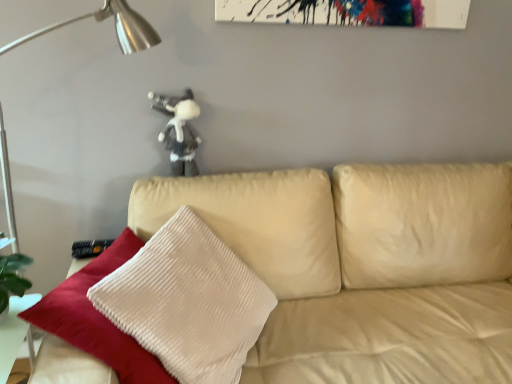
Image resolution: width=512 pixels, height=384 pixels. Identify the location of metallic silver table lamp at left. (115, 26).

Image resolution: width=512 pixels, height=384 pixels. Describe the element at coordinates (364, 267) in the screenshot. I see `beige leather couch at center` at that location.

The height and width of the screenshot is (384, 512). In order to click on beige leather couch at center in this screenshot , I will do `click(364, 267)`.

Find the location of a particular element. metallic silver table lamp at left is located at coordinates (115, 26).

From the image's perspective, does metallic silver table lamp at left appear higher than beige leather couch at center?

Yes.

Based on the photo, considering the positions of objects metallic silver table lamp at left and beige leather couch at center in the image provided, who is in front, metallic silver table lamp at left or beige leather couch at center?

Positioned in front is beige leather couch at center.

Is metallic silver table lamp at left bigger than beige leather couch at center?

Actually, metallic silver table lamp at left might be smaller than beige leather couch at center.

Is metallic silver table lamp at left to the right of beige leather couch at center from the viewer's perspective?

No, metallic silver table lamp at left is not to the right of beige leather couch at center.

From a real-world perspective, does metallic silver table lamp at left stand above white plush toy at upper center?

No, from a real-world perspective, metallic silver table lamp at left is not on top of white plush toy at upper center.

Locate an element on the screen. The width and height of the screenshot is (512, 384). table lamp below the white plush toy at upper center (from the image's perspective) is located at coordinates (115, 26).

Is metallic silver table lamp at left wider than white plush toy at upper center?

Yes, metallic silver table lamp at left is wider than white plush toy at upper center.

Looking at the image, does metallic silver table lamp at left seem bigger or smaller compared to white plush toy at upper center?

Clearly, metallic silver table lamp at left is larger in size than white plush toy at upper center.

Visually, is beige leather couch at center positioned to the left or to the right of white plush toy at upper center?

beige leather couch at center is to the right of white plush toy at upper center.

Can you confirm if beige leather couch at center is thinner than white plush toy at upper center?

No.

Is beige leather couch at center next to white plush toy at upper center and touching it?

beige leather couch at center and white plush toy at upper center are clearly separated.

Which object is further away from the camera, beige leather couch at center or metallic silver table lamp at left?

metallic silver table lamp at left is further from the camera.

Is beige leather couch at center positioned with its back to metallic silver table lamp at left?

beige leather couch at center is not turned away from metallic silver table lamp at left.

How different are the orientations of beige leather couch at center and metallic silver table lamp at left in degrees?

The angle between the facing direction of beige leather couch at center and the facing direction of metallic silver table lamp at left is 0.122 degrees.

Does beige leather couch at center have a lesser height compared to metallic silver table lamp at left?

Indeed, beige leather couch at center has a lesser height compared to metallic silver table lamp at left.

This screenshot has width=512, height=384. Find the location of `figurine to the right of metallic silver table lamp at left`. figurine to the right of metallic silver table lamp at left is located at coordinates (179, 131).

From a real-world perspective, is white plush toy at upper center above or below metallic silver table lamp at left?

Clearly, from a real-world perspective, white plush toy at upper center is above metallic silver table lamp at left.

From the image's perspective, between white plush toy at upper center and metallic silver table lamp at left, who is located below?

metallic silver table lamp at left is shown below in the image.

From a real-world perspective, is white plush toy at upper center physically located above or below beige leather couch at center?

white plush toy at upper center is above beige leather couch at center.

From the image's perspective, does white plush toy at upper center appear higher than beige leather couch at center?

Yes.

Where is `table lamp behind the beige leather couch at center`? The image size is (512, 384). table lamp behind the beige leather couch at center is located at coordinates (115, 26).

In order to click on figurine that appears on the right of metallic silver table lamp at left in this screenshot , I will do `click(179, 131)`.

Based on their spatial positions, is beige leather couch at center or white plush toy at upper center closer to metallic silver table lamp at left?

white plush toy at upper center is closer to metallic silver table lamp at left.

In the scene shown: Considering their positions, is white plush toy at upper center positioned further to beige leather couch at center than metallic silver table lamp at left?

Based on the image, metallic silver table lamp at left appears to be further to beige leather couch at center.

Looking at the image, which one is located further to beige leather couch at center, metallic silver table lamp at left or white plush toy at upper center?

metallic silver table lamp at left.

From the image, which object appears to be nearer to metallic silver table lamp at left, white plush toy at upper center or beige leather couch at center?

Based on the image, white plush toy at upper center appears to be nearer to metallic silver table lamp at left.

When comparing their distances from white plush toy at upper center, does metallic silver table lamp at left or beige leather couch at center seem closer?

metallic silver table lamp at left is closer to white plush toy at upper center.

From the image, which object appears to be nearer to white plush toy at upper center, beige leather couch at center or metallic silver table lamp at left?

Based on the image, metallic silver table lamp at left appears to be nearer to white plush toy at upper center.

This screenshot has height=384, width=512. Identify the location of figurine between metallic silver table lamp at left and beige leather couch at center in the horizontal direction. (179, 131).